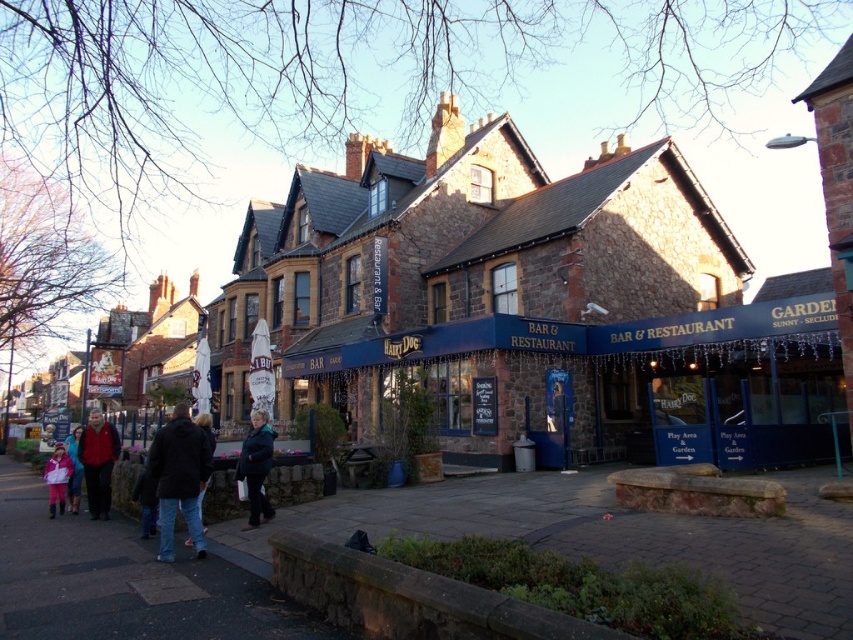
Is red wool coat at lower left to the left of light pink fabric at lower left from the viewer's perspective?

Yes, red wool coat at lower left is to the left of light pink fabric at lower left.

Which is more to the right, red wool coat at lower left or light pink fabric at lower left?

Positioned to the right is light pink fabric at lower left.

The height and width of the screenshot is (640, 853). What are the coordinates of `red wool coat at lower left` in the screenshot? It's located at (97, 461).

I want to click on red wool coat at lower left, so click(x=97, y=461).

Who is taller, blue stone bar at center or dark blue jacket at lower left?

Standing taller between the two is dark blue jacket at lower left.

Between point (488, 348) and point (165, 456), which one is positioned behind?

The point (488, 348) is behind.

Does point (480, 339) lie behind point (161, 484)?

Yes.

The width and height of the screenshot is (853, 640). Find the location of `blue stone bar at center`. blue stone bar at center is located at coordinates (573, 333).

Is stone building at center shorter than blue stone bar at center?

No.

Consider the image. Which is above, stone building at center or blue stone bar at center?

Positioned higher is stone building at center.

What do you see at coordinates (526, 289) in the screenshot? I see `stone building at center` at bounding box center [526, 289].

The height and width of the screenshot is (640, 853). Identify the location of stone building at center. (526, 289).